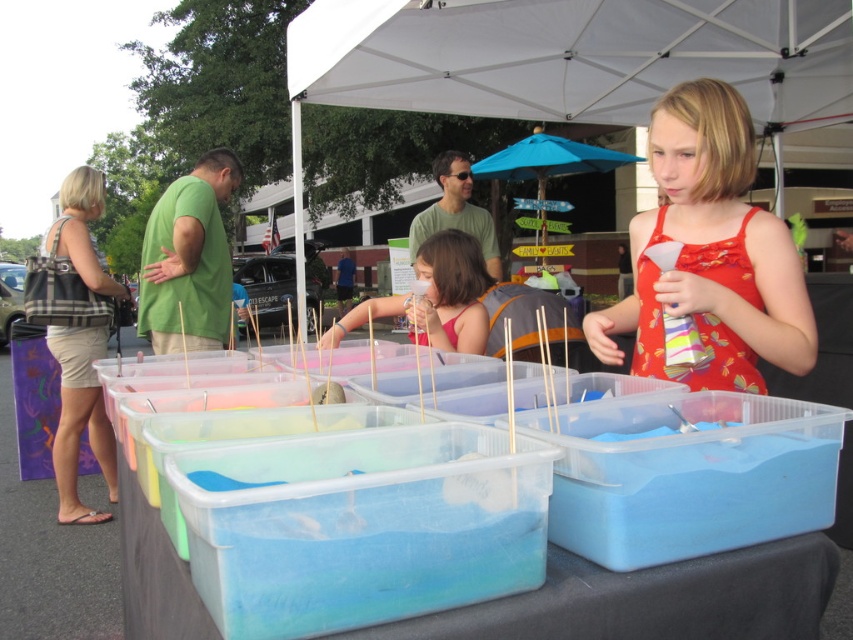
You are a photographer at the event and want to ensure the matte orange sundress at center is fully visible in the photo. Should you adjust the blue fabric umbrella at center to avoid blocking it?

The matte orange sundress at center is positioned under the blue fabric umbrella at center, so adjusting the umbrella would help ensure the dress is fully visible in the photo.

You are a photographer at the event and want to capture both the matte orange sundress at center and the matte pink dress at center in the same frame. Based on their positions, which dress should you focus on first to ensure both are in the shot?

The matte orange sundress at center is located above the matte pink dress at center, so focusing on the matte orange sundress at center first will help ensure both dresses are captured in the frame since it is positioned higher up.

You are a photographer positioned at the back of the scene. You want to take a photo that includes both the matte orange sundress at center and the blue fabric umbrella at center. Which object will appear larger in your photo?

The matte orange sundress at center will appear larger in the photo because it is closer to the viewer than the blue fabric umbrella at center.